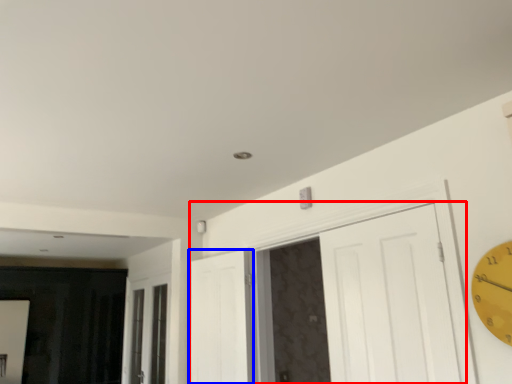
Question: Which point is closer to the camera, door (highlighted by a red box) or door (highlighted by a blue box)?

Choices:
 (A) door
 (B) door

Answer: (A)